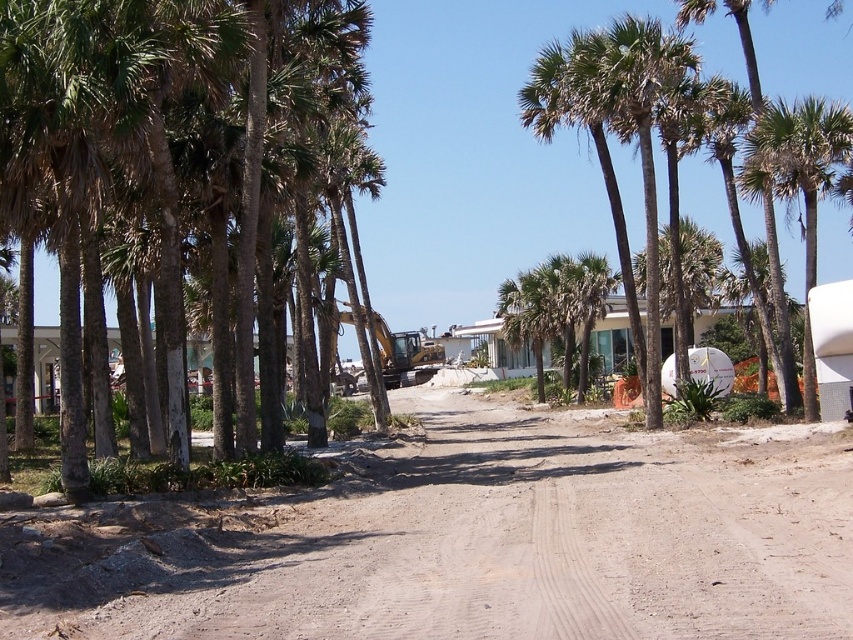
You are a drone operator tasked with capturing aerial footage of the construction site. The green leafy palm trees at left are located at coordinates point 0.172, 0.168. If you want to ensure the palm trees are in the frame while focusing on the construction site, where should you position your drone?

The green leafy palm trees at left are located at coordinates point (142, 109). To include them in the frame while focusing on the construction site, position the drone slightly to the left of the construction area, ensuring the coordinates (142, 109) are within the camera view.

You are standing on the dirt path in the construction site and see the green leafy palm trees at left and the green leafy palm tree at center. Which one is nearer to you?

The green leafy palm trees at left is closer to the viewer than the green leafy palm tree at center, so the green leafy palm trees at left is nearer to you.